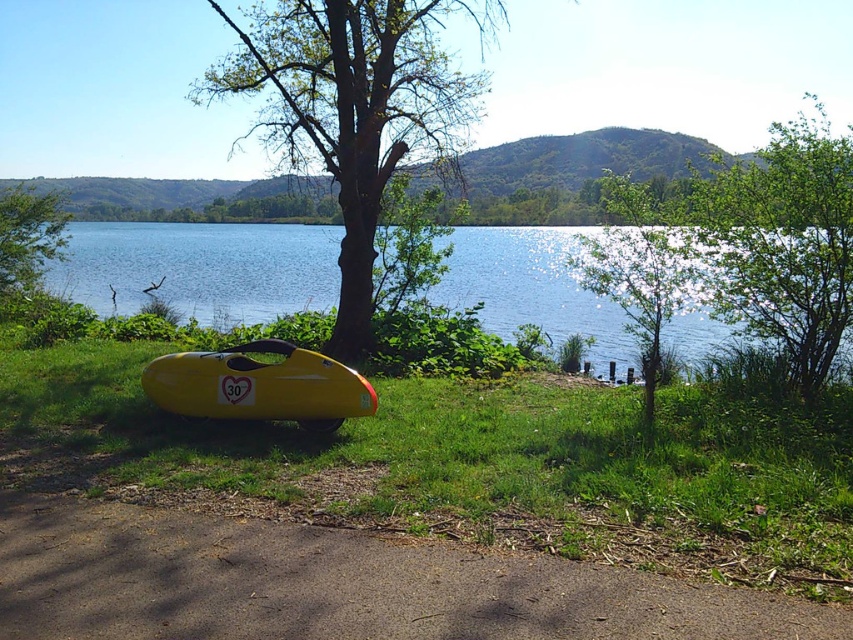
Question: Is green grass at center to the left of green matte tree at center from the viewer's perspective?

Choices:
 (A) yes
 (B) no

Answer: (B)

Question: Considering the relative positions of green grass at center and green matte tree at lower left in the image provided, where is green grass at center located with respect to green matte tree at lower left?

Choices:
 (A) left
 (B) right

Answer: (B)

Question: Which point is closer to the camera taking this photo?

Choices:
 (A) (612, 352)
 (B) (682, 548)
 (C) (189, 385)
 (D) (0, 248)

Answer: (B)

Question: Does green leafy tree at upper right have a lesser width compared to transparent plastic water at center?

Choices:
 (A) no
 (B) yes

Answer: (B)

Question: Which point is farther from the camera taking this photo?

Choices:
 (A) (44, 256)
 (B) (144, 392)

Answer: (A)

Question: Which object is farther from the camera taking this photo?

Choices:
 (A) green leafy tree at upper right
 (B) transparent plastic water at center
 (C) yellow matte boat at lower center
 (D) green grass at center

Answer: (B)